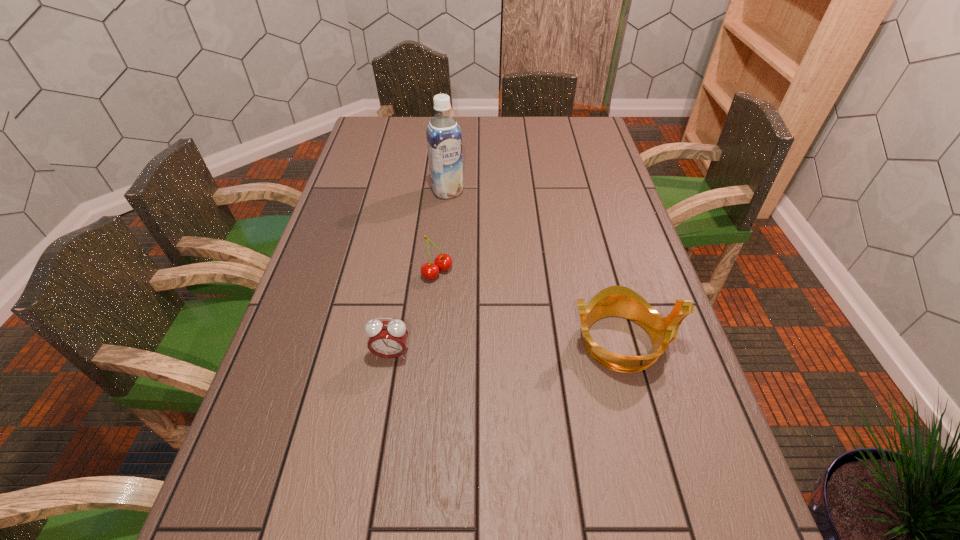
You are a GUI agent. You are given a task and a screenshot of the screen. Output one action in this format:
    pyautogui.click(x=<x>, y=<y>)
    Task: Click on the blank space that satisfies the following two spatial constraints: 1. on the front side of the tiara; 2. at the front emblem of the third nearest object
    The width and height of the screenshot is (960, 540).
    Given the screenshot: What is the action you would take?
    pyautogui.click(x=431, y=341)

This screenshot has width=960, height=540. I want to click on vacant space that satisfies the following two spatial constraints: 1. on the front side of the rightmost object; 2. at the front emblem of the third nearest object, so click(431, 341).